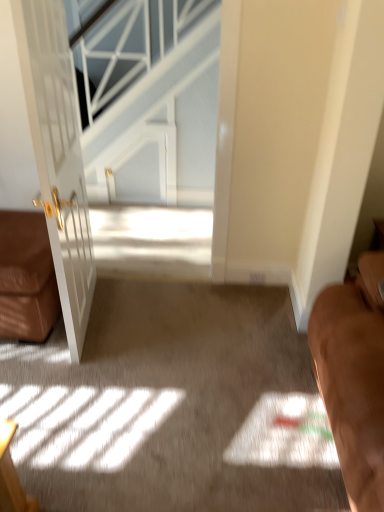
Question: Is brown leather couch at left a part of white textured glass at upper center?

Choices:
 (A) no
 (B) yes

Answer: (A)

Question: Considering the relative sizes of white textured glass at upper center and brown leather couch at left in the image provided, is white textured glass at upper center taller than brown leather couch at left?

Choices:
 (A) yes
 (B) no

Answer: (A)

Question: Is white textured glass at upper center oriented away from brown leather couch at left?

Choices:
 (A) yes
 (B) no

Answer: (B)

Question: Is white textured glass at upper center positioned behind brown leather couch at left?

Choices:
 (A) yes
 (B) no

Answer: (A)

Question: From a real-world perspective, is white textured glass at upper center positioned over brown leather couch at left based on gravity?

Choices:
 (A) no
 (B) yes

Answer: (B)

Question: Considering the relative sizes of white textured glass at upper center and brown leather couch at left in the image provided, is white textured glass at upper center shorter than brown leather couch at left?

Choices:
 (A) no
 (B) yes

Answer: (A)

Question: Can you confirm if brown leather couch at left is shorter than white textured glass at upper center?

Choices:
 (A) yes
 (B) no

Answer: (A)

Question: Is white textured glass at upper center inside brown leather couch at left?

Choices:
 (A) no
 (B) yes

Answer: (A)

Question: Can you confirm if brown leather couch at left is smaller than white textured glass at upper center?

Choices:
 (A) yes
 (B) no

Answer: (A)

Question: Does brown leather couch at left have a greater height compared to white textured glass at upper center?

Choices:
 (A) no
 (B) yes

Answer: (A)

Question: Is brown leather couch at left outside white textured glass at upper center?

Choices:
 (A) yes
 (B) no

Answer: (A)

Question: From a real-world perspective, is brown leather couch at left positioned over white textured glass at upper center based on gravity?

Choices:
 (A) yes
 (B) no

Answer: (B)

Question: From the image's perspective, is white textured glass at upper center on white glossy door at left?

Choices:
 (A) no
 (B) yes

Answer: (B)